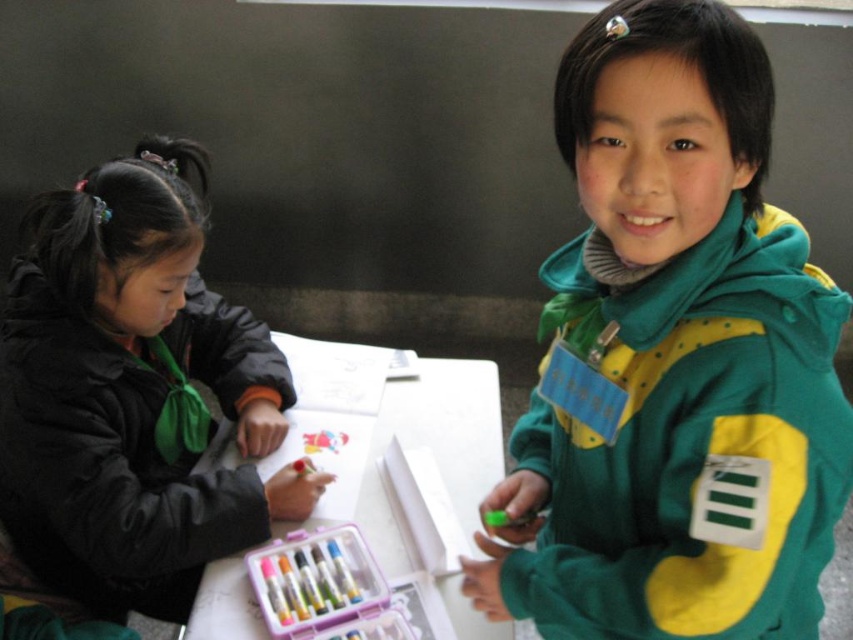
Is green fleece jacket at upper right smaller than black matte jacket at left?

Correct, green fleece jacket at upper right occupies less space than black matte jacket at left.

Identify the location of green fleece jacket at upper right. Image resolution: width=853 pixels, height=640 pixels. (677, 358).

This screenshot has height=640, width=853. Describe the element at coordinates (677, 358) in the screenshot. I see `green fleece jacket at upper right` at that location.

Where is `green fleece jacket at upper right`? The width and height of the screenshot is (853, 640). green fleece jacket at upper right is located at coordinates (677, 358).

Between black matte jacket at left and white paper at center, which one has less height?

white paper at center is shorter.

In order to click on black matte jacket at left in this screenshot , I will do `click(134, 392)`.

I want to click on black matte jacket at left, so click(x=134, y=392).

Is green fleece jacket at upper right bigger than white paper at center?

Yes, green fleece jacket at upper right is bigger than white paper at center.

Which is behind, point (749, 385) or point (294, 376)?

Positioned behind is point (294, 376).

Locate an element on the screen. The width and height of the screenshot is (853, 640). green fleece jacket at upper right is located at coordinates (677, 358).

The width and height of the screenshot is (853, 640). Find the location of `green fleece jacket at upper right`. green fleece jacket at upper right is located at coordinates (677, 358).